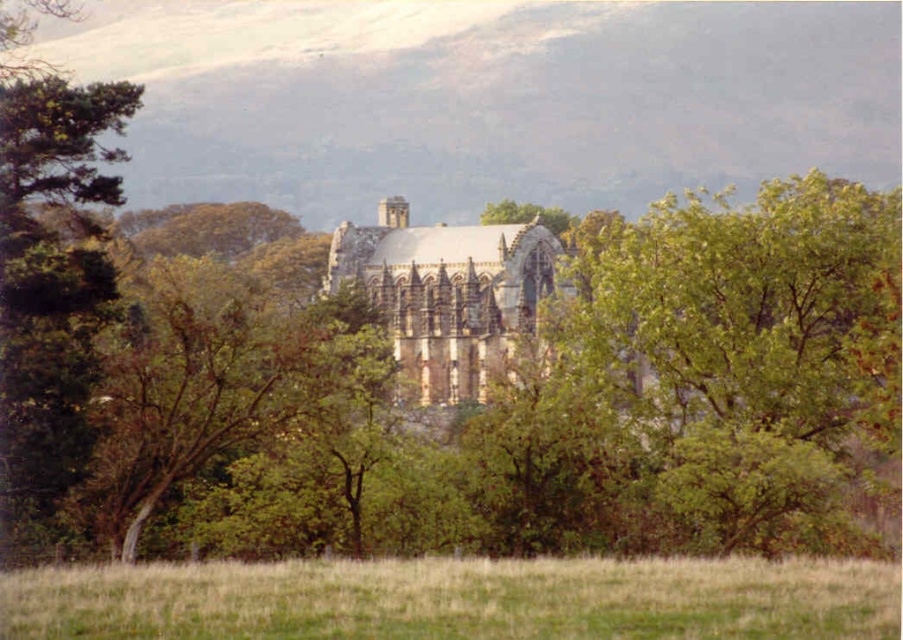
Which is behind, point (774, 205) or point (389, 564)?

The point (774, 205) is behind.

Does green leafy tree at center appear on the left side of green grass at lower center?

In fact, green leafy tree at center is to the right of green grass at lower center.

Does point (743, 275) lie behind point (113, 628)?

That is True.

I want to click on green leafy tree at center, so click(x=743, y=342).